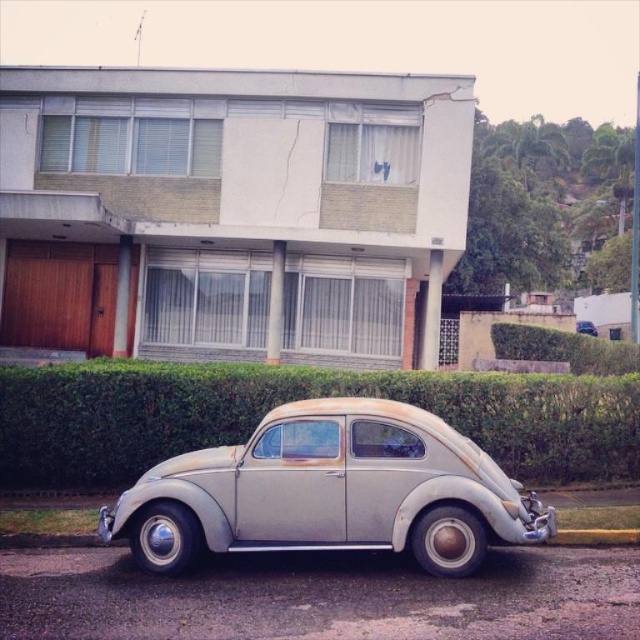
You are a delivery person trying to park your van next to the rusty metallic car at center and the green leafy hedge at lower center. Which object should you avoid to ensure enough space for your van?

You should avoid the green leafy hedge at lower center because the rusty metallic car at center is thinner, meaning the hedge occupies more space, making it the obstacle to avoid for sufficient parking space.

You are a delivery person trying to park your van next to the rusty metallic car at center and the green leafy hedge at lower center. Based on their heights, can you determine which one you need to avoid hitting when lowering your van? Please explain your reasoning.

The rusty metallic car at center is not as tall as the green leafy hedge at lower center. Therefore, you should avoid hitting the green leafy hedge at lower center when lowering your van because it is taller than the car.

You are standing on the sidewalk in front of the building and want to take a photo of both the rusty metallic car at center and the green leafy hedge at lower center. Which object should you focus on first to ensure both are in clear view?

You should focus on the rusty metallic car at center first because it is closer to the viewer than the green leafy hedge at lower center, so adjusting focus from near to far will help both objects be in clear view.